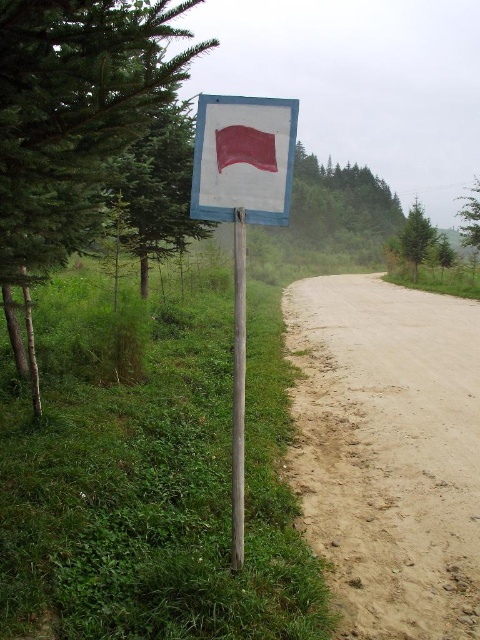
Based on the photo, you are a hiker who wants to reach the brown sandy dirt track at right. Based on the scene description, where should you look to find it?

The brown sandy dirt track at right is located at point [388,451], so you should look towards the lower right area of the image to find it.

You are a hiker planning to walk from the brown sandy dirt track at right to the blue painted wood pole at center. Which direction should you move to get closer to the pole?

The brown sandy dirt track at right is closer to the viewer than the blue painted wood pole at center, so you should move towards the center of the image to get closer to the pole.